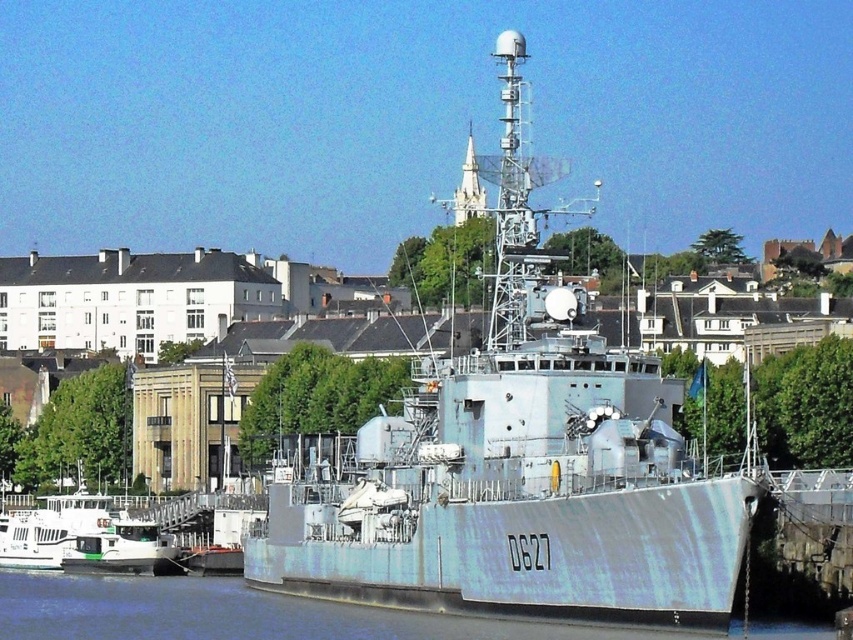
Question: Is light blue metallic ship at center above blue metallic water at lower center?

Choices:
 (A) no
 (B) yes

Answer: (B)

Question: Considering the relative positions of light blue metallic ship at center and blue metallic water at lower center in the image provided, where is light blue metallic ship at center located with respect to blue metallic water at lower center?

Choices:
 (A) right
 (B) left

Answer: (A)

Question: Among these points, which one is nearest to the camera?

Choices:
 (A) (177, 609)
 (B) (608, 600)

Answer: (B)

Question: Is light blue metallic ship at center wider than blue metallic water at lower center?

Choices:
 (A) yes
 (B) no

Answer: (B)

Question: Which point is farther to the camera?

Choices:
 (A) light blue metallic ship at center
 (B) blue metallic water at lower center

Answer: (B)

Question: Among these objects, which one is farthest from the camera?

Choices:
 (A) light blue metallic ship at center
 (B) blue metallic water at lower center

Answer: (B)